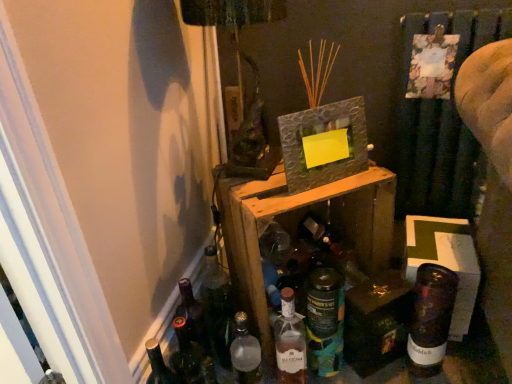
Question: From the image's perspective, is translucent glass bottle at center, arranged as the second bottle when viewed from the right, above or below wooden crate at center?

Choices:
 (A) above
 (B) below

Answer: (B)

Question: Do you think translucent glass bottle at center, arranged as the 3th bottle when viewed from the left, is within wooden crate at center, or outside of it?

Choices:
 (A) inside
 (B) outside

Answer: (B)

Question: Based on their relative distances, which object is nearer to the textured gray picture frame at upper center?

Choices:
 (A) shiny metallic box at lower right
 (B) cardboard box at lower right
 (C) wooden crate at center
 (D) translucent glass bottle at center, arranged as the 3th bottle when viewed from the left
 (E) matte glass bottle at center, which is the 3th bottle from right to left

Answer: (C)

Question: Considering the real-world distances, which object is closest to the textured gray picture frame at upper center?

Choices:
 (A) cardboard box at lower right
 (B) matte glass bottle at center, which is the second bottle in left-to-right order
 (C) wooden crate at center
 (D) shiny metallic box at lower right
 (E) translucent glass bottle at center, arranged as the 3th bottle when viewed from the left

Answer: (C)